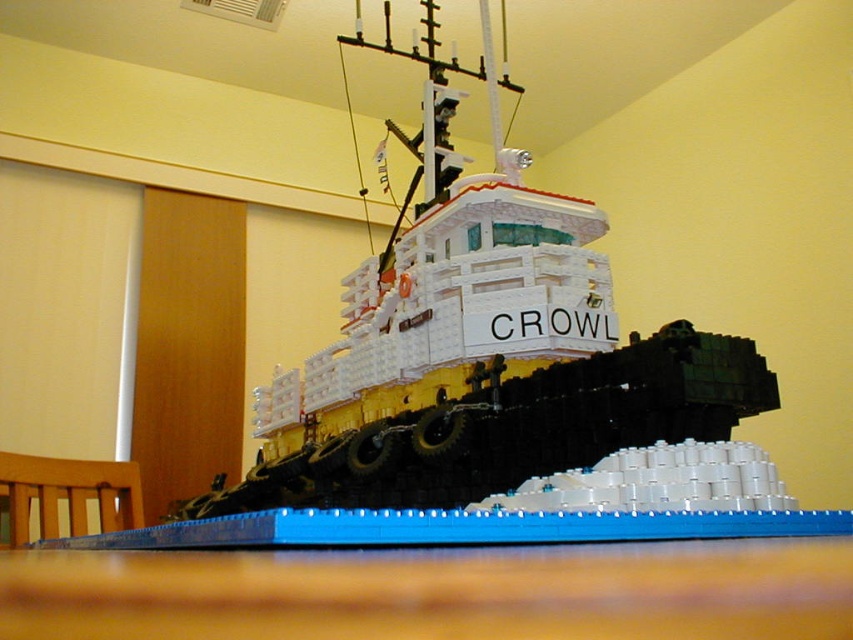
Looking at this image, you are a photographer setting up a shoot for a product catalog. You need to position the white plastic boat at center and the blue plastic table at lower center in such a way that the boat appears elevated. Based on the scene description, is the current arrangement suitable for your requirement?

Yes, the current arrangement is suitable because the white plastic boat at center is located above the blue plastic table at lower center, which means it already appears elevated as required.

In the scene shown: You are a LEGO designer examining the tugboat model. You notice two points marked on the crane structure. The first point is at coordinate [485,220] and the second is at [717,584]. From your current viewpoint, which point is closer to you?

Point [717,584] is closer to you because it is in front of point [485,220] according to their spatial arrangement.

You are a LEGO enthusiast examining a display. You need to place a new LEGO set on the table next to the white plastic boat at center. The new set requires a space wider than the boat. Can the blue plastic table at lower center accommodate it?

The white plastic boat at center is wider than the blue plastic table at lower center. Since the new set requires a space wider than the boat, the blue plastic table at lower center cannot accommodate it.